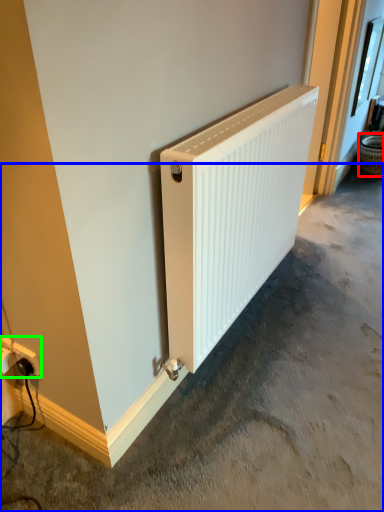
Question: Based on their relative distances, which object is nearer to basket (highlighted by a red box)? Choose from concrete (highlighted by a blue box) and power plugs and sockets (highlighted by a green box).

Choices:
 (A) concrete
 (B) power plugs and sockets

Answer: (A)